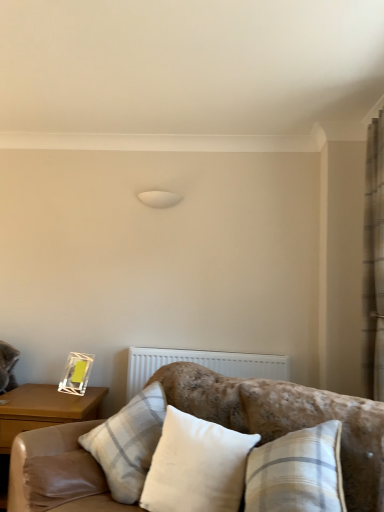
Question: From a real-world perspective, is white textured radiator at center above or below white cotton pillow at center, which ranks as the 1th pillow in front-to-back order?

Choices:
 (A) below
 (B) above

Answer: (B)

Question: Visually, is white textured radiator at center positioned to the left or to the right of white cotton pillow at center, which ranks as the 1th pillow in front-to-back order?

Choices:
 (A) left
 (B) right

Answer: (B)

Question: Which object is positioned farthest from the white fabric pillow at center, marked as the second pillow in a front-to-back arrangement?

Choices:
 (A) white textured radiator at center
 (B) white cotton pillow at center, which ranks as the 1th pillow in front-to-back order
 (C) velvet beige couch at lower center
 (D) beige textured curtain at right
 (E) wooden nightstand at left

Answer: (D)

Question: Which object is positioned farthest from the white textured radiator at center?

Choices:
 (A) velvet beige couch at lower center
 (B) beige textured curtain at right
 (C) white fabric pillow at center, which is counted as the first pillow, starting from the back
 (D) white cotton pillow at center, which ranks as the 1th pillow in front-to-back order
 (E) wooden nightstand at left

Answer: (D)